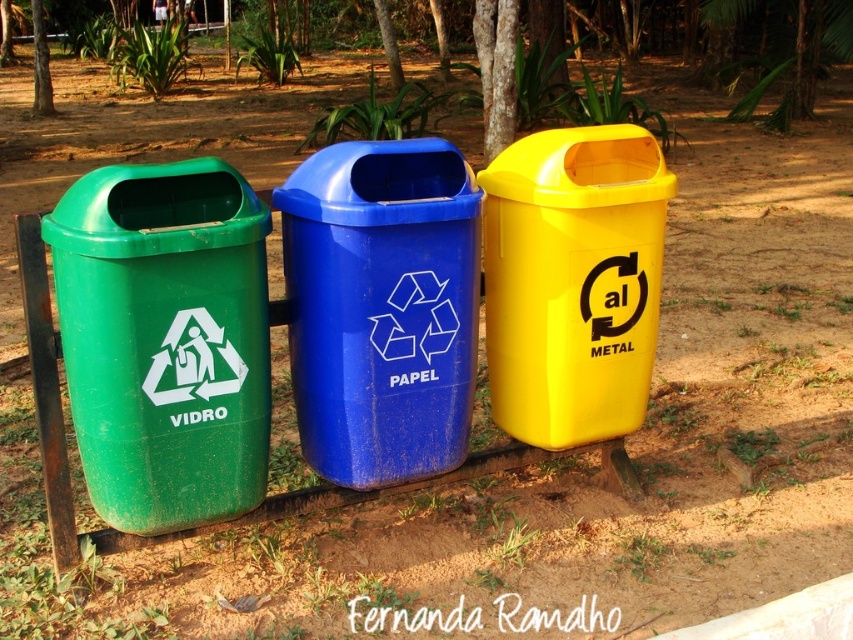
Question: Which object is farther from the camera taking this photo?

Choices:
 (A) green plastic tree at upper left
 (B) yellow plastic bin at right
 (C) green plastic/recycled bin at left
 (D) brown rough bark at center

Answer: (A)

Question: Which of the following is the farthest from the observer?

Choices:
 (A) yellow plastic bin at right
 (B) blue plastic/recycled paper bin at center
 (C) green plastic/recycled bin at left

Answer: (A)

Question: Is green plastic bin at left smaller than green plastic tree at upper left?

Choices:
 (A) yes
 (B) no

Answer: (B)

Question: Based on their relative distances, which object is farther from the green plastic tree at upper left?

Choices:
 (A) brown rough bark at center
 (B) green plastic tree at center
 (C) blue plastic/recycled paper bin at center

Answer: (C)

Question: Is brown rough bark at center to the left of green plastic tree at upper left from the viewer's perspective?

Choices:
 (A) no
 (B) yes

Answer: (A)

Question: Is the position of brown rough bark at center more distant than that of green plastic tree at center?

Choices:
 (A) no
 (B) yes

Answer: (A)